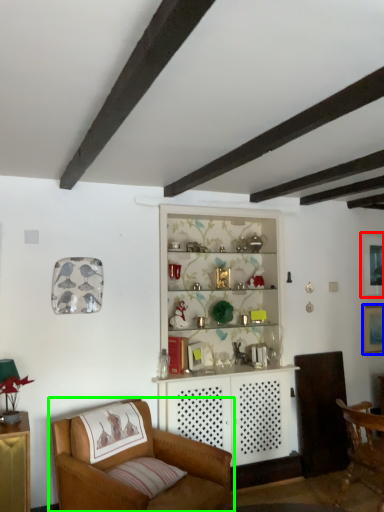
Question: Which object is the closest to the picture frame (highlighted by a red box)? Choose among these: picture frame (highlighted by a blue box) or chair (highlighted by a green box).

Choices:
 (A) picture frame
 (B) chair

Answer: (A)